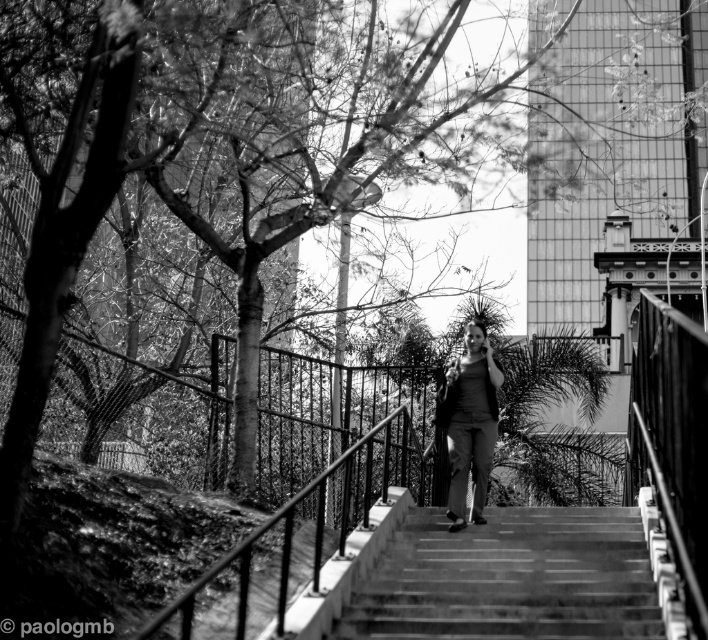
Question: Is smooth concrete stairs at center positioned in front of matte gray pants at center?

Choices:
 (A) no
 (B) yes

Answer: (B)

Question: Which is nearer to the matte gray pants at center?

Choices:
 (A) smooth concrete stairs at center
 (B) smooth metal railing at center

Answer: (A)

Question: Is smooth concrete stairs at center positioned before smooth metal railing at center?

Choices:
 (A) yes
 (B) no

Answer: (B)

Question: Which point is farther to the camera?

Choices:
 (A) (462, 515)
 (B) (498, 620)

Answer: (A)

Question: Is smooth metal railing at center closer to camera compared to matte gray pants at center?

Choices:
 (A) no
 (B) yes

Answer: (B)

Question: Which object is the farthest from the matte gray pants at center?

Choices:
 (A) smooth metal railing at center
 (B) smooth concrete stairs at center

Answer: (A)